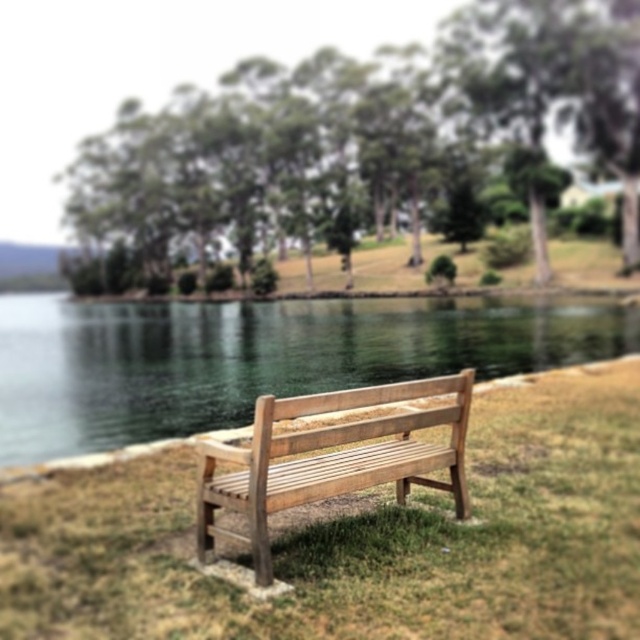
Question: Which of these objects is positioned closest to the light brown wooden bench at center?

Choices:
 (A) natural grass bench at center
 (B) green leafy trees at upper center

Answer: (A)

Question: Is clear water at bench right to the right of light brown wooden bench at center from the viewer's perspective?

Choices:
 (A) no
 (B) yes

Answer: (A)

Question: Does green leafy trees at upper center have a greater width compared to light brown wooden bench at center?

Choices:
 (A) yes
 (B) no

Answer: (A)

Question: Estimate the real-world distances between objects in this image. Which object is farther from the green leafy trees at upper center?

Choices:
 (A) clear water at bench right
 (B) light brown wooden bench at center

Answer: (B)

Question: Can you confirm if natural grass bench at center is smaller than light brown wooden bench at center?

Choices:
 (A) no
 (B) yes

Answer: (B)

Question: Which is nearer to the light brown wooden bench at center?

Choices:
 (A) green leafy trees at upper center
 (B) natural grass bench at center

Answer: (B)